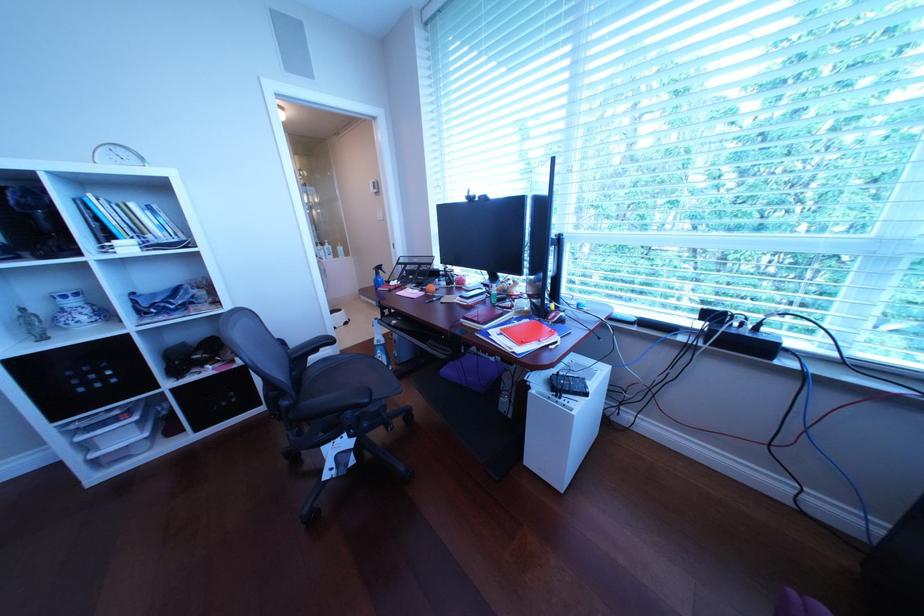
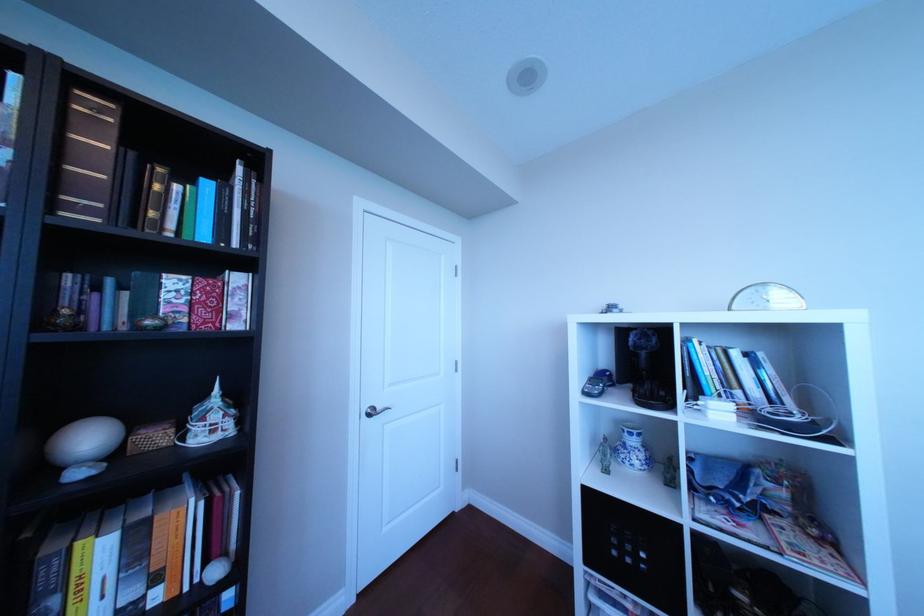
Question: The images are taken continuously from a first-person perspective. In which direction is your viewpoint rotating?

Choices:
 (A) Left
 (B) Right
 (C) Up
 (D) Down

Answer: (A)